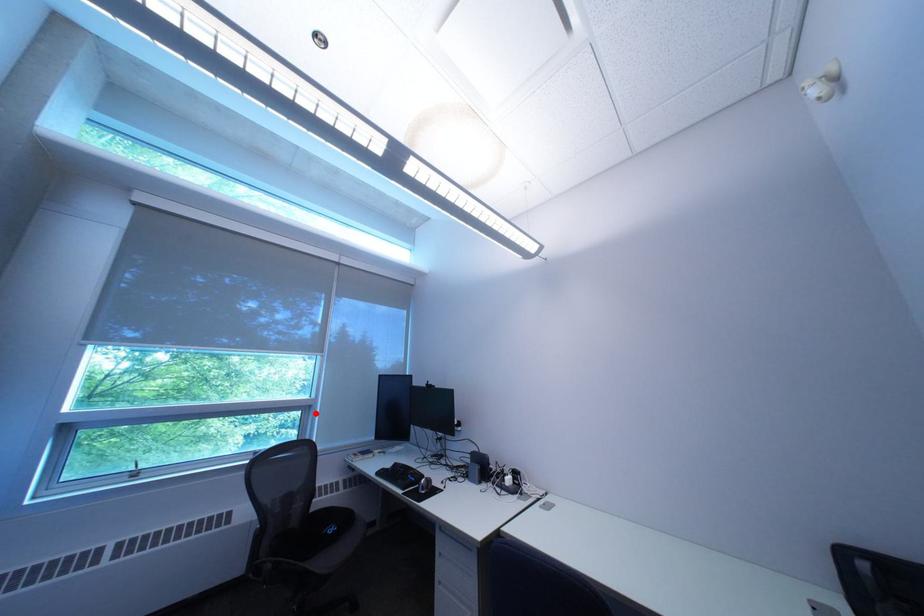
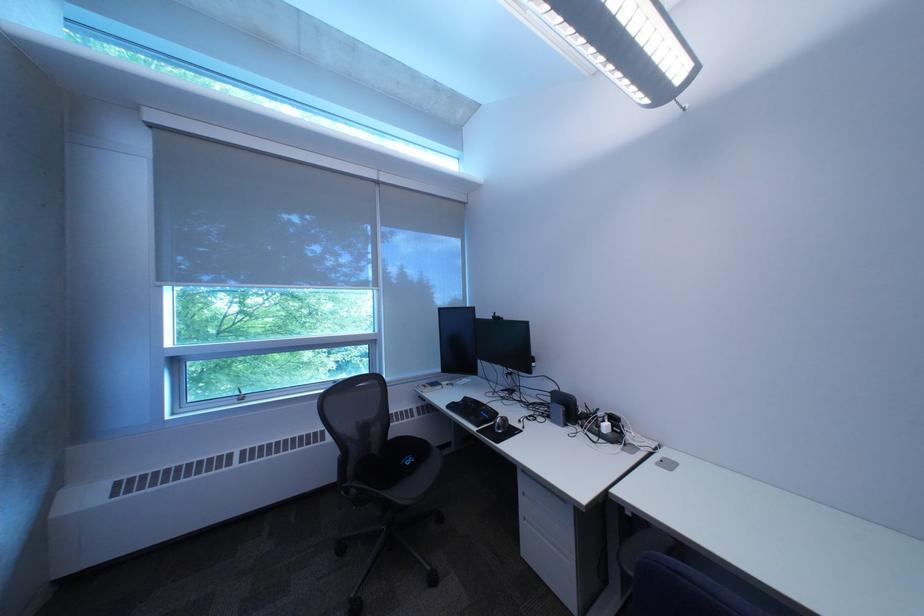
Locate, in the second image, the point that corresponds to the highlighted location in the first image.

(383, 347)